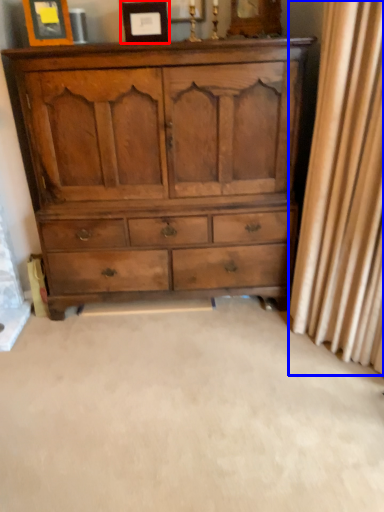
Question: Which point is further to the camera, picture frame (highlighted by a red box) or curtain (highlighted by a blue box)?

Choices:
 (A) picture frame
 (B) curtain

Answer: (A)